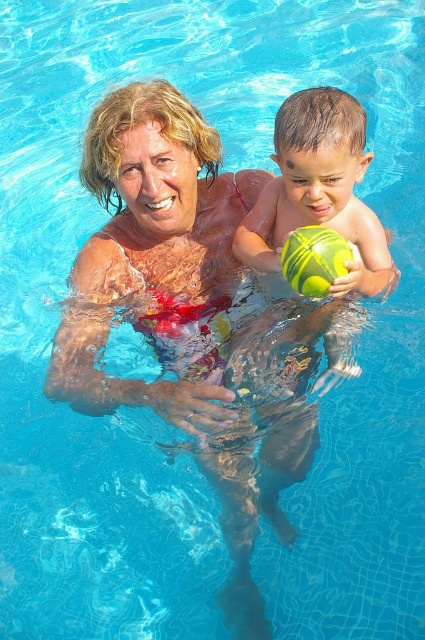
Question: Is green rubber ball at center positioned behind yellow-green rubber ball at center?

Choices:
 (A) yes
 (B) no

Answer: (A)

Question: Which point is farther to the camera?

Choices:
 (A) yellow-green rubber ball at center
 (B) green rubber ball at center

Answer: (B)

Question: Can you confirm if green rubber ball at center is wider than yellow-green rubber ball at center?

Choices:
 (A) yes
 (B) no

Answer: (A)

Question: Which point is farther to the camera?

Choices:
 (A) green rubber ball at center
 (B) yellow-green rubber ball at center

Answer: (A)

Question: Is green rubber ball at center wider than yellow-green rubber ball at center?

Choices:
 (A) yes
 (B) no

Answer: (A)

Question: Which point is closer to the camera?

Choices:
 (A) (317, 289)
 (B) (311, 104)

Answer: (B)